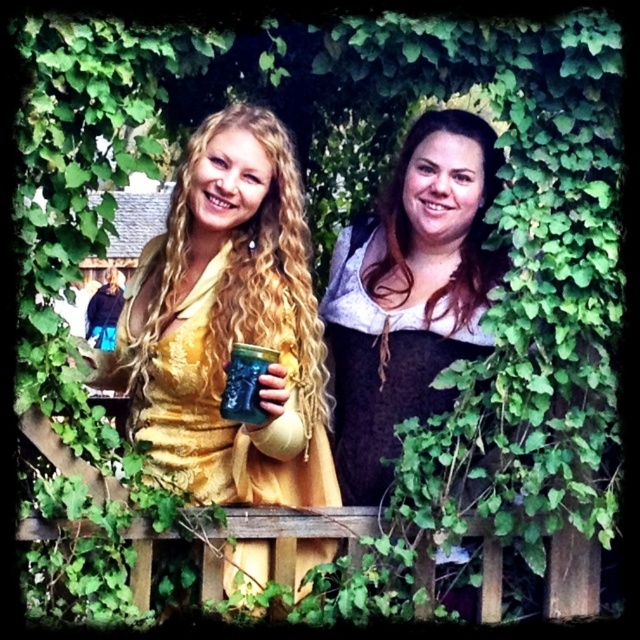
Question: Which of the following is the closest to the observer?

Choices:
 (A) (369, 300)
 (B) (221, 422)
 (C) (225, 529)
 (D) (228, 413)

Answer: (D)

Question: Which point is closer to the camera taking this photo?

Choices:
 (A) (378, 400)
 (B) (486, 524)
 (C) (164, 234)

Answer: (B)

Question: Which object appears closest to the camera in this image?

Choices:
 (A) green glass jar at center
 (B) brown matte dress at center
 (C) matte yellow dress at center
 (D) dark brown leather dress at center

Answer: (A)

Question: From the image, what is the correct spatial relationship of matte yellow dress at center in relation to wooden fence at center?

Choices:
 (A) below
 (B) above

Answer: (B)

Question: From the image, what is the correct spatial relationship of wooden fence at center in relation to green glass jar at center?

Choices:
 (A) above
 (B) below

Answer: (B)

Question: Does wooden fence at center have a larger size compared to brown matte dress at center?

Choices:
 (A) yes
 (B) no

Answer: (A)